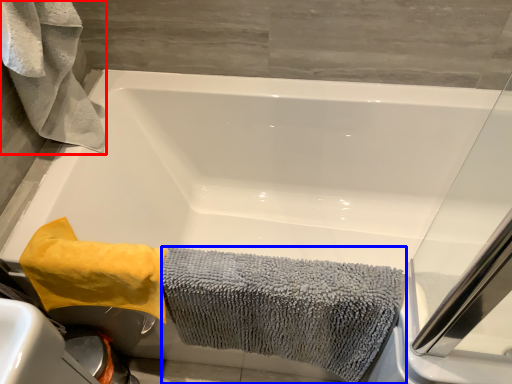
Question: Which of the following is the closest to the observer, bath towel (highlighted by a red box) or bath towel (highlighted by a blue box)?

Choices:
 (A) bath towel
 (B) bath towel

Answer: (A)